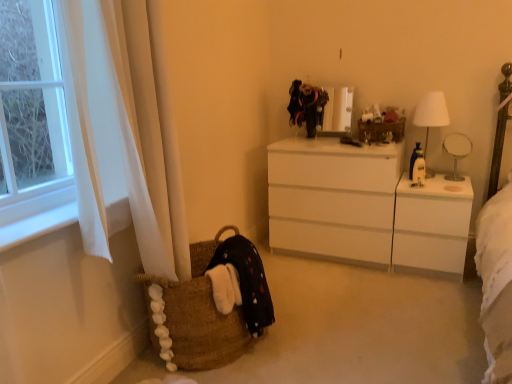
Locate an element on the screen. empty space that is in between white glossy changing table at right and brown woven basket at lower left is located at coordinates (342, 304).